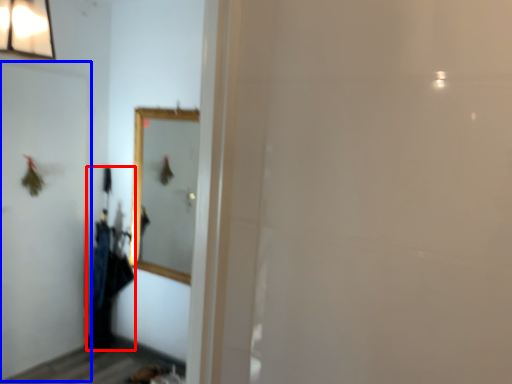
Question: Which point is closer to the camera, laundry (highlighted by a red box) or screen door (highlighted by a blue box)?

Choices:
 (A) laundry
 (B) screen door

Answer: (B)